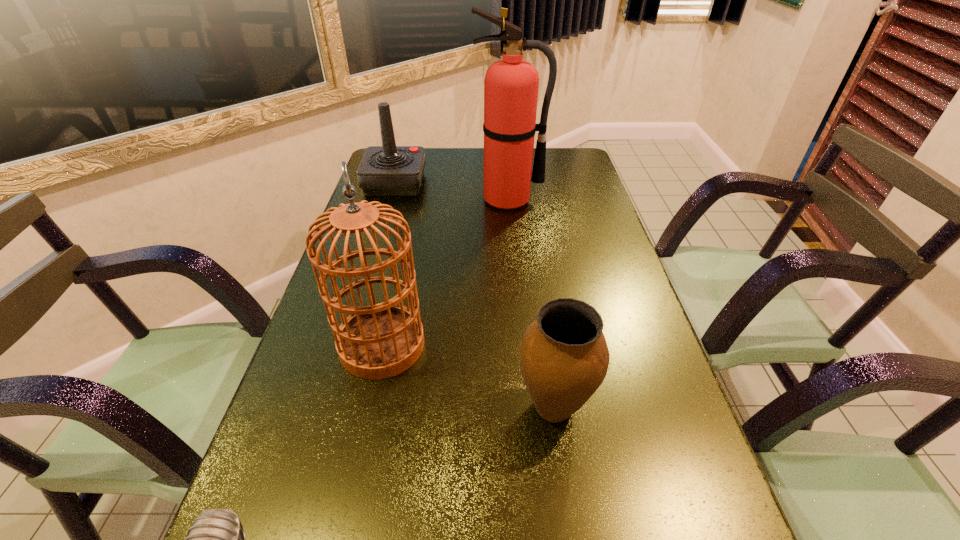
At what (x,y) coordinates should I click in order to perform the action: click on joystick located in the left edge section of the desktop. Please return your answer as a coordinate pair (x, y). The image size is (960, 540). Looking at the image, I should click on (388, 170).

The image size is (960, 540). Identify the location of object that is positioned at the right edge. (564, 357).

I want to click on object that is at the far left corner, so pyautogui.click(x=388, y=170).

Locate an element on the screen. This screenshot has height=540, width=960. vacant space at the left edge is located at coordinates (298, 525).

You are a GUI agent. You are given a task and a screenshot of the screen. Output one action in this format:
    pyautogui.click(x=<x>, y=<y>)
    Task: Click on the free location at the right edge
    The image size is (960, 540).
    Given the screenshot: What is the action you would take?
    pyautogui.click(x=610, y=242)

Locate an element on the screen. vacant region at the far right corner is located at coordinates (554, 167).

Find the location of a particular element. Image resolution: width=960 pixels, height=540 pixels. free point between the urn and the birdcage is located at coordinates (468, 376).

The height and width of the screenshot is (540, 960). What are the coordinates of `free space between the urn and the tallest object` in the screenshot? It's located at (531, 303).

Image resolution: width=960 pixels, height=540 pixels. I want to click on free point between the urn and the fourth shortest object, so click(x=468, y=376).

I want to click on object that can be found as the third closest to the urn, so click(511, 85).